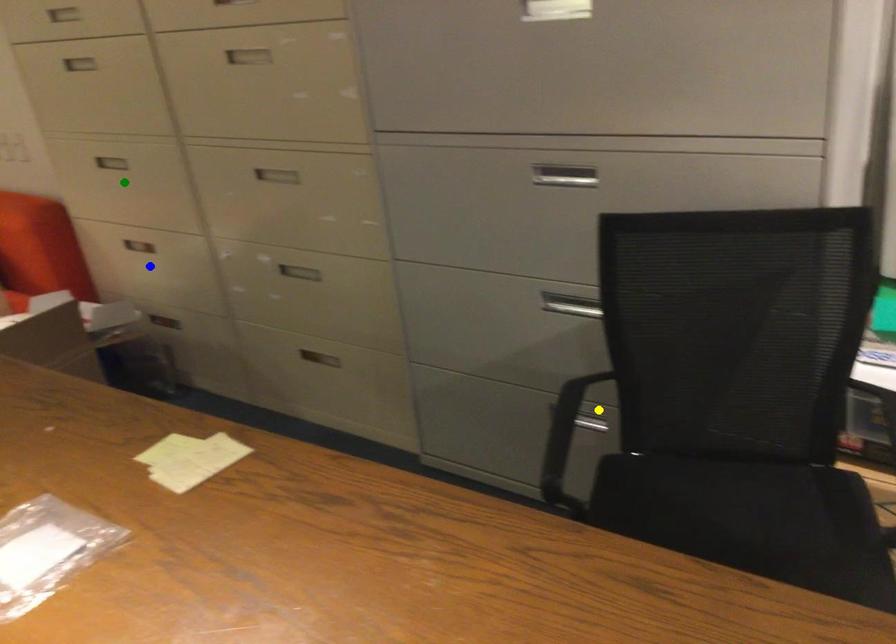
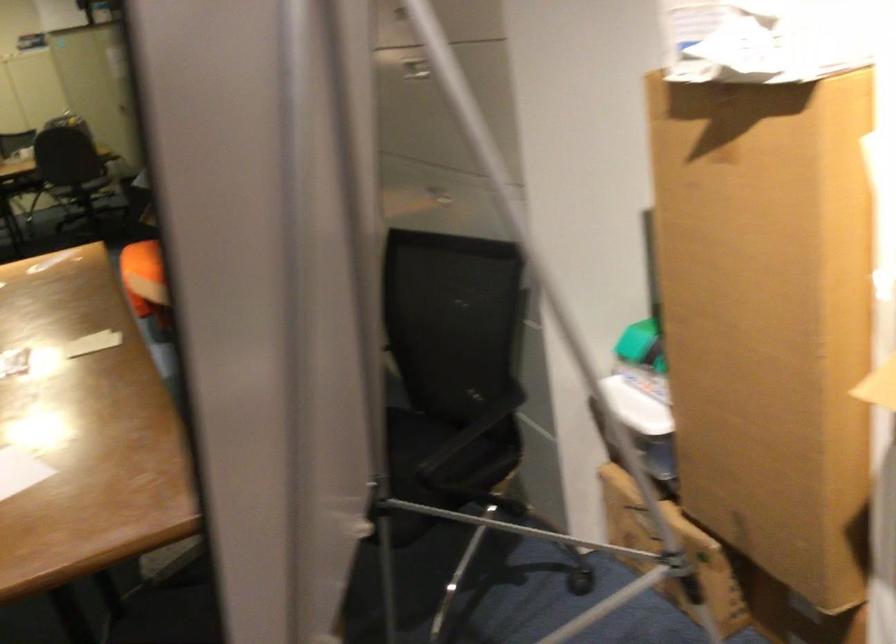
I am providing you with two images of the same scene from different viewpoints. Three points are marked in image1. Which point corresponds to a part or object that is occluded in image2?In image1, three points are marked. Which of them correspond to a part or object that is occluded in image2?Among the three points shown in image1, which one corresponds to a part or object that is no longer visible due to occlusion in image2?

Invisible in image2: yellow point, blue point, green point.